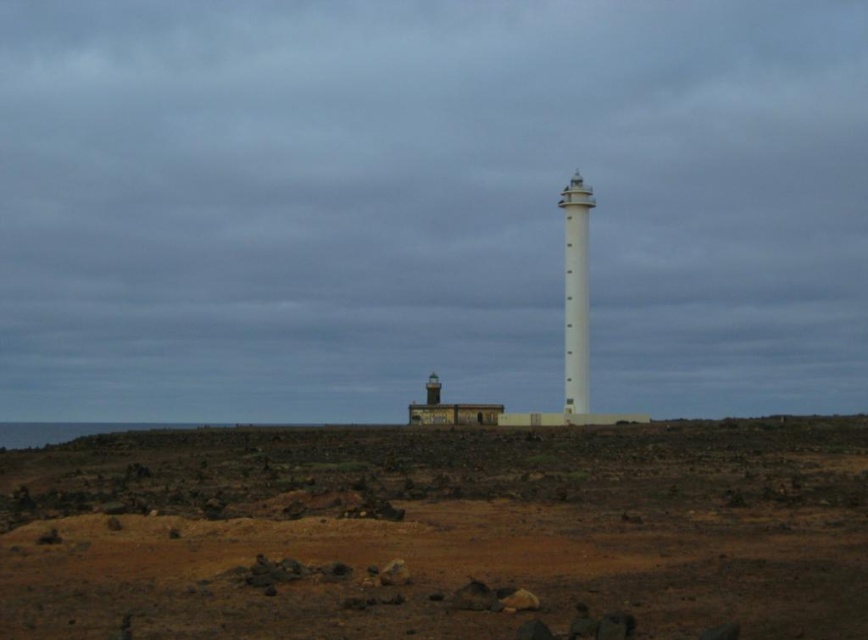
You are standing at the origin point of the image, which is at the bottom left corner. You want to walk to the brown dirt at lower center. What are the coordinates you need to reach?

The coordinates to reach the brown dirt at lower center are at point (x=438, y=531).

You are a hiker who just arrived at the coastal area and you see the brown dirt at lower center and the white smooth tower at center. Which object is larger in size?

The brown dirt at lower center is bigger than the white smooth tower at center.

You are a hiker trying to navigate between the brown dirt at lower center and the white smooth tower at center. Which path would you choose to ensure stability and avoid unstable ground?

The brown dirt at lower center is wider than the white smooth tower at center, so choosing the path over the brown dirt at lower center would provide a more stable and wider base, avoiding the narrower and potentially unstable ground near the white smooth tower at center.